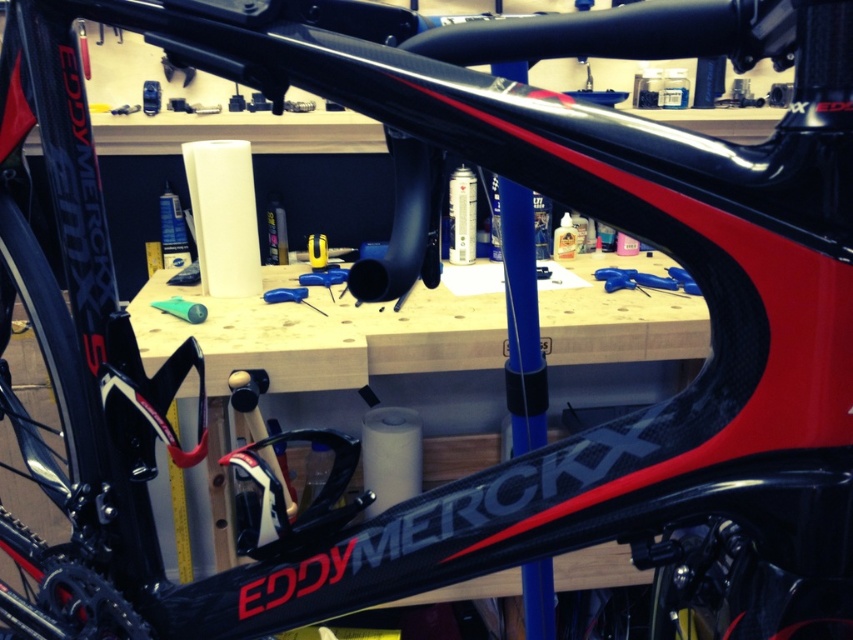
You are a bicycle mechanic working in a workshop. You need to locate the blue rubber handlebar tape at center and the green rubber tube at center. According to the scene, which object is positioned to the right of the other?

The blue rubber handlebar tape at center is to the right of the green rubber tube at center.

You are a mechanic working in a workshop. You need to locate the black rubber tire at lower left to repair it. The coordinates given are point (56, 467). Based on the image, is this point the correct location for the black rubber tire at lower left?

Yes, the point (56, 467) corresponds to the black rubber tire at lower left as per the provided description.